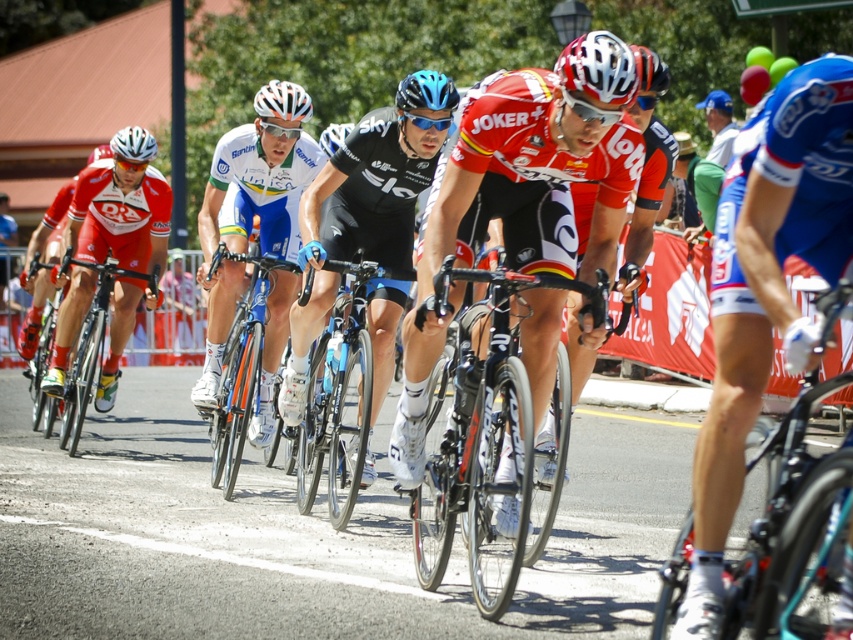
Question: Observing the image, what is the correct spatial positioning of orange metallic bicycle at center in reference to blue matte bicycle helmet at center?

Choices:
 (A) right
 (B) left

Answer: (B)

Question: Does teal glossy bicycle at center appear on the right side of blue matte helmet at center?

Choices:
 (A) no
 (B) yes

Answer: (B)

Question: Which object appears closest to the camera in this image?

Choices:
 (A) shiny black bicycle at center
 (B) shiny black bicycle at left

Answer: (A)

Question: Which of the following is the closest to the observer?

Choices:
 (A) shiny black bicycle at left
 (B) orange metallic bicycle at center
 (C) white matte helmet at upper left
 (D) blue matte helmet at upper center

Answer: (B)

Question: Does teal glossy bicycle at center appear on the left side of blue matte helmet at center?

Choices:
 (A) no
 (B) yes

Answer: (A)

Question: Which point is farther from the camera taking this photo?

Choices:
 (A) (577, 68)
 (B) (407, 109)
 (C) (299, 128)

Answer: (C)